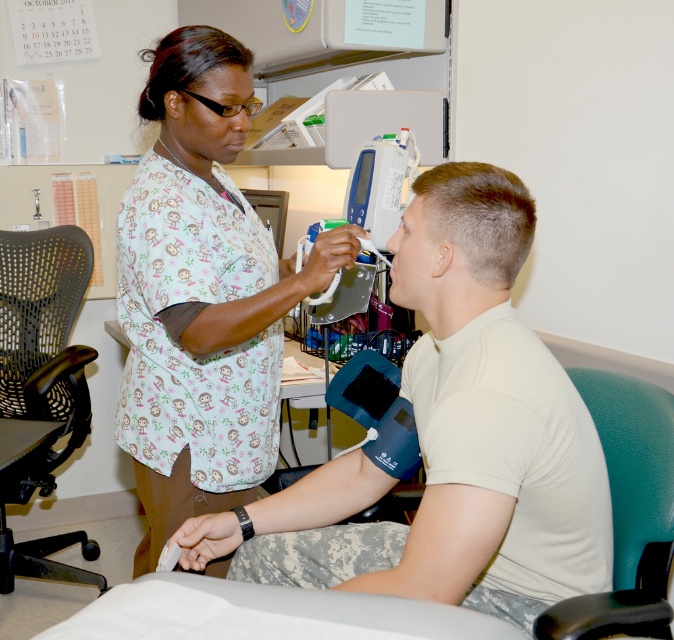
In the medical setting scene, there is a healthcare professional in light blue scrub top with small monkeys and pink flowers, and a patient in a green office chair. A point at coordinates (202, 294) is marked. What object is located at this point?

The point at coordinates (202, 294) indicates white printed scrubs at center.

You are a healthcare professional who needs to sit down while reviewing a patient chart. The white printed scrubs at center and the teal leather chair at right are in the room. Which one should you choose to sit on?

The teal leather chair at right is the seating option available. The white printed scrubs at center is a clothing item worn by the healthcare provider and not a chair, so you should sit on the teal leather chair at right.

You are a nurse who needs to adjust the height of chairs in the examination room to accommodate a patient who uses a wheelchair. The wheelchair has a seat height of 18 inches. Which chair between the black mesh office chair at left and the teal leather chair at right should you adjust to ensure proper wheelchair transfer height?

The black mesh office chair at left has a greater height compared to the teal leather chair at right, so you should lower the black mesh office chair at left to match the wheelchair seat height of 18 inches for safe transfer.